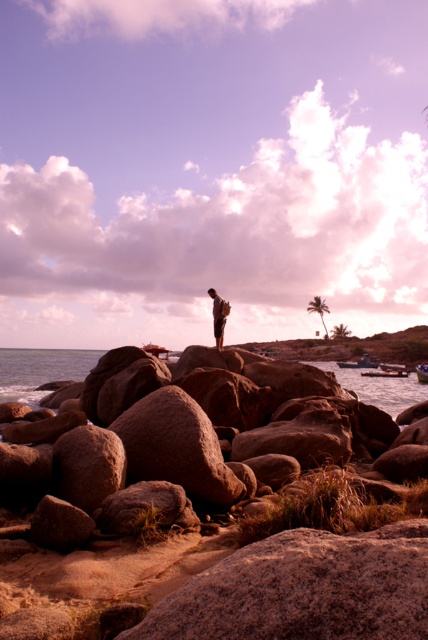
Between green leafy palm tree at upper right and green leafy palm tree at center-right, which one appears on the left side from the viewer's perspective?

Positioned to the left is green leafy palm tree at upper right.

How far apart are green leafy palm tree at upper right and green leafy palm tree at center-right?

A distance of 24.61 feet exists between green leafy palm tree at upper right and green leafy palm tree at center-right.

Where is `green leafy palm tree at upper right`? green leafy palm tree at upper right is located at coordinates (318, 308).

Is the position of smooth brown water at center less distant than that of green leafy palm tree at upper right?

That is True.

Who is positioned more to the left, smooth brown water at center or green leafy palm tree at upper right?

Positioned to the left is smooth brown water at center.

Measure the distance between point (400,380) and camera.

They are 42.38 meters apart.

Where is `smooth brown water at center`? smooth brown water at center is located at coordinates (39, 371).

Is brown leather backpack at center bigger than green leafy palm tree at upper right?

Actually, brown leather backpack at center might be smaller than green leafy palm tree at upper right.

Who is shorter, brown leather backpack at center or green leafy palm tree at upper right?

brown leather backpack at center

Where is `brown leather backpack at center`? brown leather backpack at center is located at coordinates (219, 316).

This screenshot has height=640, width=428. What are the coordinates of `brown leather backpack at center` in the screenshot? It's located at (219, 316).